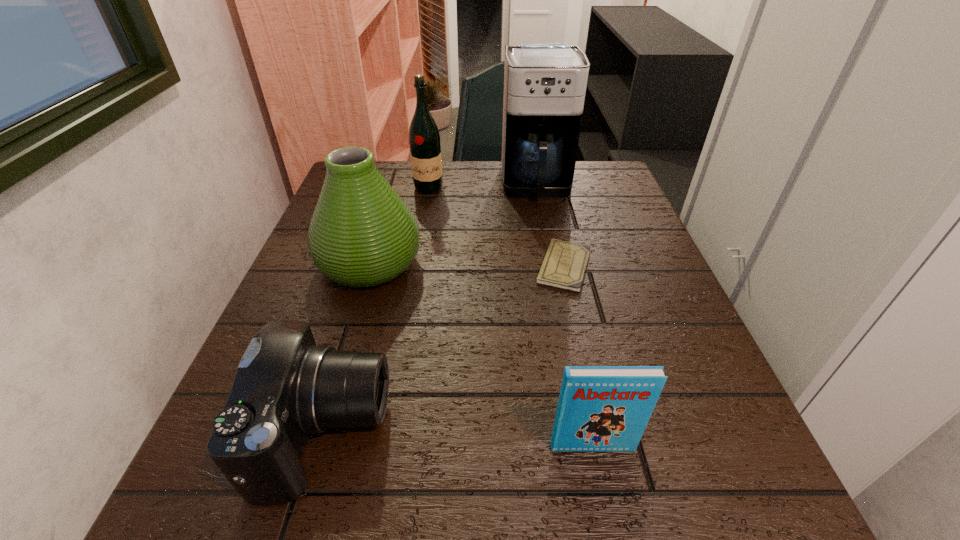
The height and width of the screenshot is (540, 960). I want to click on vacant area between the liquor and the book, so click(x=511, y=318).

I want to click on free space between the coffee maker and the camera, so click(x=431, y=309).

The image size is (960, 540). I want to click on free space between the second shortest object and the liquor, so click(377, 310).

At what (x,y) coordinates should I click in order to perform the action: click on empty space between the second shortest object and the coffee maker. Please return your answer as a coordinate pair (x, y). Looking at the image, I should click on (431, 309).

The width and height of the screenshot is (960, 540). I want to click on free spot between the book and the liquor, so click(x=511, y=318).

Find the location of `unoccupied area between the coffee maker and the liquor`. unoccupied area between the coffee maker and the liquor is located at coordinates (482, 187).

Locate an element on the screen. The width and height of the screenshot is (960, 540). free spot between the vase and the coffee maker is located at coordinates (453, 224).

Where is `the fifth closest object to the camera`? the fifth closest object to the camera is located at coordinates (425, 149).

Locate an element on the screen. The height and width of the screenshot is (540, 960). the second closest object to the liquor is located at coordinates (362, 234).

Where is `free location that satisfies the following two spatial constraints: 1. on the front-facing side of the liquor; 2. on the lens of the camera`? This screenshot has height=540, width=960. free location that satisfies the following two spatial constraints: 1. on the front-facing side of the liquor; 2. on the lens of the camera is located at coordinates (386, 433).